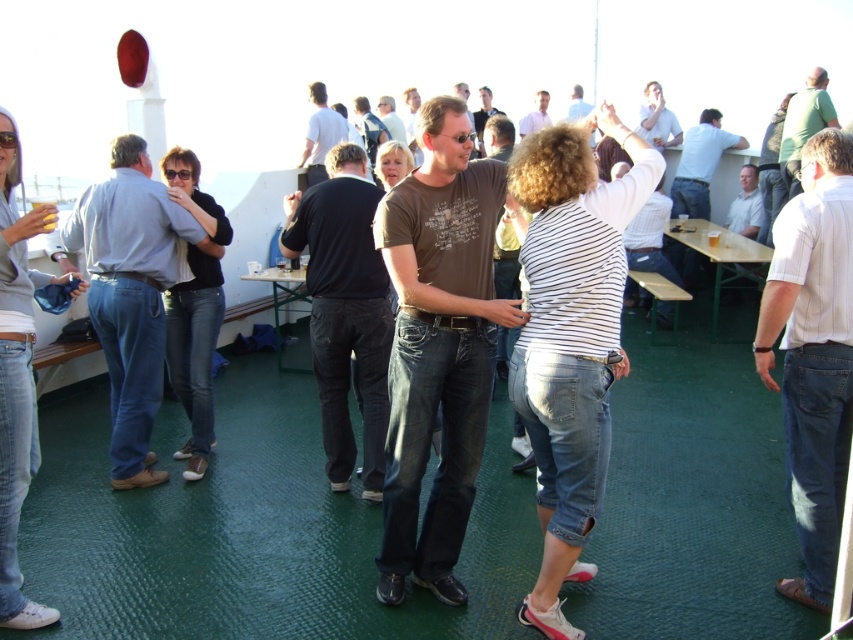
Question: In this image, where is light blue denim jeans at left located relative to light brown shirt at center?

Choices:
 (A) left
 (B) right

Answer: (A)

Question: Observing the image, what is the correct spatial positioning of light brown shirt at center in reference to brown leather jacket at center?

Choices:
 (A) left
 (B) right

Answer: (B)

Question: Which point is farther to the camera?

Choices:
 (A) (308, 145)
 (B) (386, 125)
 (C) (659, 109)

Answer: (B)

Question: Which object is positioned farthest from the white shirt at center?

Choices:
 (A) white striped shirt at center
 (B) light blue denim jeans at left

Answer: (B)

Question: Does white striped shirt at center lie in front of green matte shirt at upper right?

Choices:
 (A) yes
 (B) no

Answer: (A)

Question: Which point appears farthest from the camera in this image?

Choices:
 (A) click(x=486, y=115)
 (B) click(x=824, y=538)

Answer: (A)